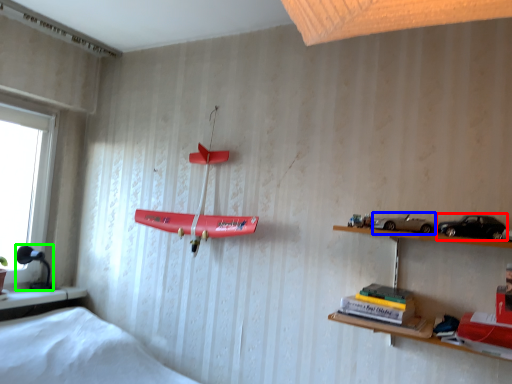
Question: Which object is the closest to the toy car (highlighted by a red box)? Choose among these: toy car (highlighted by a blue box) or lamp (highlighted by a green box).

Choices:
 (A) toy car
 (B) lamp

Answer: (A)